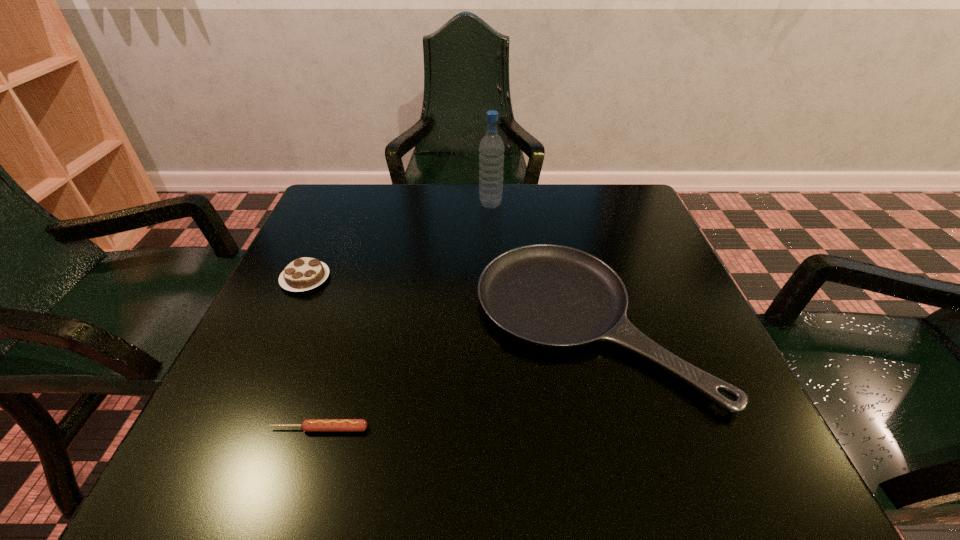
Identify the location of vacant space at the far left corner of the desktop. This screenshot has width=960, height=540. (352, 201).

This screenshot has width=960, height=540. In the image, there is a desktop. What are the coordinates of `vacant space at the near right corner` in the screenshot? It's located at (718, 460).

Locate an element on the screen. free spot between the chocolate cake and the sausage is located at coordinates (312, 354).

Image resolution: width=960 pixels, height=540 pixels. Find the location of `vacant area that lies between the sausage and the third tallest object`. vacant area that lies between the sausage and the third tallest object is located at coordinates (454, 375).

The image size is (960, 540). What are the coordinates of `empty location between the chocolate cake and the frying pan` in the screenshot? It's located at (447, 300).

You are a GUI agent. You are given a task and a screenshot of the screen. Output one action in this format:
    pyautogui.click(x=<x>, y=<y>)
    Task: Click on the empty space that is in between the sausage and the chocolate cake
    Image resolution: width=960 pixels, height=540 pixels.
    Given the screenshot: What is the action you would take?
    pyautogui.click(x=312, y=354)

At what (x,y) coordinates should I click in order to perform the action: click on free space between the sausage and the frying pan. Please return your answer as a coordinate pair (x, y). The width and height of the screenshot is (960, 540). Looking at the image, I should click on (454, 375).

Where is `unoccupied position between the farthest object and the chocolate cake`? unoccupied position between the farthest object and the chocolate cake is located at coordinates (398, 242).

You are a GUI agent. You are given a task and a screenshot of the screen. Output one action in this format:
    pyautogui.click(x=<x>, y=<y>)
    Task: Click on the free spot between the shortest object and the water bottle
    
    Given the screenshot: What is the action you would take?
    pyautogui.click(x=405, y=316)

Image resolution: width=960 pixels, height=540 pixels. What are the coordinates of `vacant space that's between the chocolate cake and the farthest object` in the screenshot? It's located at (398, 242).